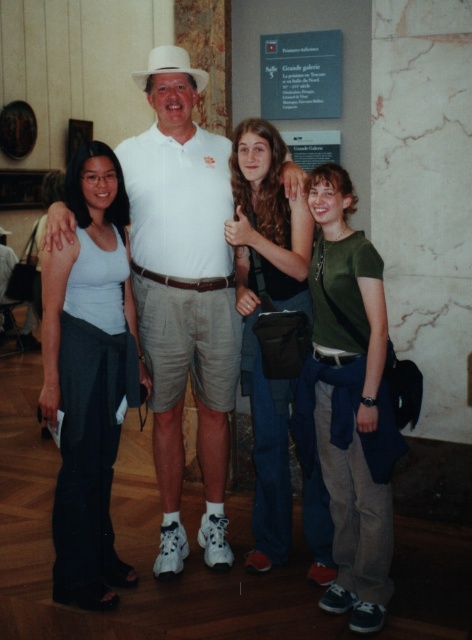
Is white cotton shirt at center bigger than white matte tank top at left?

Correct, white cotton shirt at center is larger in size than white matte tank top at left.

Which is above, white cotton shirt at center or white matte tank top at left?

white cotton shirt at center is higher up.

Describe the element at coordinates (184, 301) in the screenshot. I see `white cotton shirt at center` at that location.

Identify the location of white cotton shirt at center. (184, 301).

Does green matte shirt at right have a lesser width compared to white matte cowboy hat at center?

No, green matte shirt at right is not thinner than white matte cowboy hat at center.

Which is above, green matte shirt at right or white matte cowboy hat at center?

white matte cowboy hat at center

Which is in front, point (356, 376) or point (193, 74)?

Point (356, 376) is in front.

Where is `green matte shirt at right`? Image resolution: width=472 pixels, height=640 pixels. green matte shirt at right is located at coordinates (351, 403).

Is green matte shirt at right below green cotton shirt at center?

Correct, green matte shirt at right is located below green cotton shirt at center.

Can you confirm if green matte shirt at right is positioned above green cotton shirt at center?

Incorrect, green matte shirt at right is not positioned above green cotton shirt at center.

Who is more forward, (367, 461) or (284, 211)?

Point (367, 461) is in front.

Locate an element on the screen. This screenshot has width=472, height=640. green matte shirt at right is located at coordinates (351, 403).